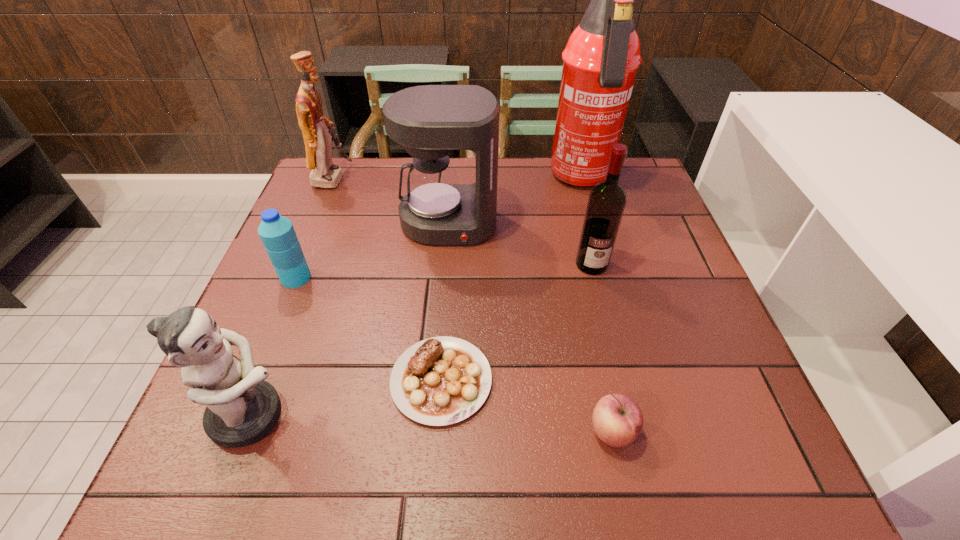
Locate an element on the screen. This screenshot has width=960, height=540. vacant point at the left edge is located at coordinates (287, 290).

The width and height of the screenshot is (960, 540). In the image, there is a desktop. What are the coordinates of `vacant space at the right edge` in the screenshot? It's located at (710, 312).

Find the location of a particular element. The width and height of the screenshot is (960, 540). free space between the figurine and the water bottle is located at coordinates (274, 347).

You are a GUI agent. You are given a task and a screenshot of the screen. Output one action in this format:
    pyautogui.click(x=<x>, y=<y>)
    Task: Click on the vacant area that lies between the second shortest object and the coffee maker
    The image size is (960, 540).
    Given the screenshot: What is the action you would take?
    pyautogui.click(x=530, y=328)

This screenshot has width=960, height=540. I want to click on free space between the water bottle and the figurine, so click(x=274, y=347).

At what (x,y) coordinates should I click in order to perform the action: click on vacant region between the steak and the fire extinguisher. Please return your answer as a coordinate pair (x, y). Looking at the image, I should click on (512, 280).

Locate an element on the screen. vacant space that is in between the alcohol and the apple is located at coordinates (602, 348).

This screenshot has height=540, width=960. Find the location of `unoccupied area between the figurine and the nutcracker`. unoccupied area between the figurine and the nutcracker is located at coordinates (292, 297).

Where is `free point between the figurine and the coffee maker`? The width and height of the screenshot is (960, 540). free point between the figurine and the coffee maker is located at coordinates (350, 320).

Where is `empty space between the coffee maker and the sixth tallest object`? Image resolution: width=960 pixels, height=540 pixels. empty space between the coffee maker and the sixth tallest object is located at coordinates (372, 251).